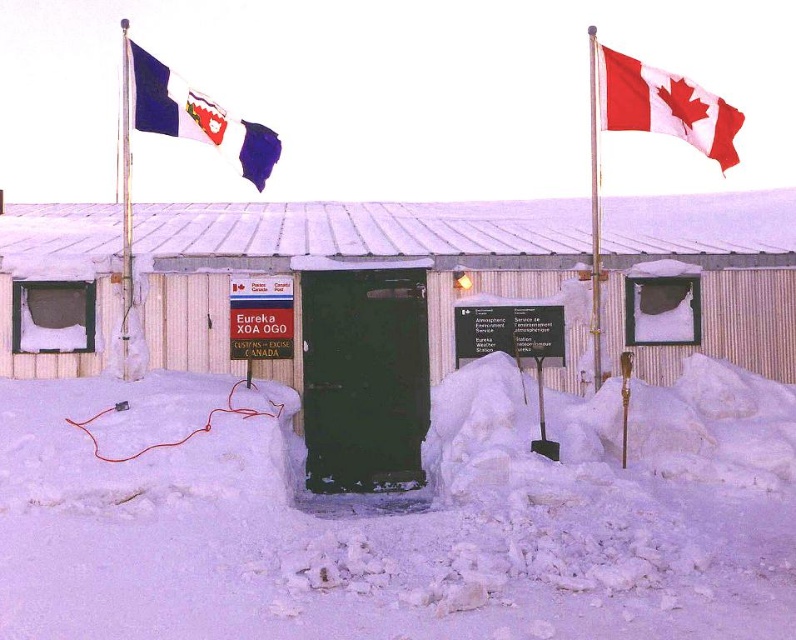
Is green corrugated metal hut at center wider than metallic silver flag pole at left?

Correct, the width of green corrugated metal hut at center exceeds that of metallic silver flag pole at left.

Which of these two, green corrugated metal hut at center or metallic silver flag pole at left, stands shorter?

Standing shorter between the two is green corrugated metal hut at center.

Find the location of a particular element. green corrugated metal hut at center is located at coordinates (359, 304).

Is white fabric flag at upper right bigger than metallic silver flag pole at left?

Incorrect, white fabric flag at upper right is not larger than metallic silver flag pole at left.

Locate an element on the screen. The width and height of the screenshot is (796, 640). white fabric flag at upper right is located at coordinates (664, 106).

Locate an element on the screen. white fabric flag at upper right is located at coordinates (664, 106).

In the scene shown: Can you confirm if green corrugated metal hut at center is wider than blue fabric flag at upper left?

Yes, green corrugated metal hut at center is wider than blue fabric flag at upper left.

Locate an element on the screen. green corrugated metal hut at center is located at coordinates (359, 304).

Who is more distant from viewer, (455, 342) or (137, 45)?

Point (137, 45)

I want to click on green corrugated metal hut at center, so click(x=359, y=304).